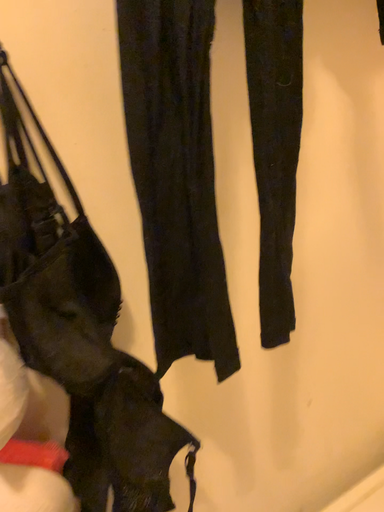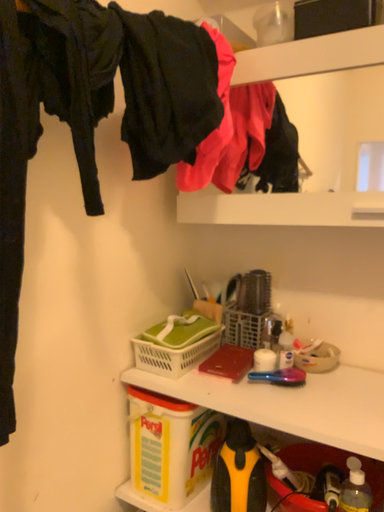
Question: How did the camera likely rotate when shooting the video?

Choices:
 (A) rotated upward
 (B) rotated downward

Answer: (A)